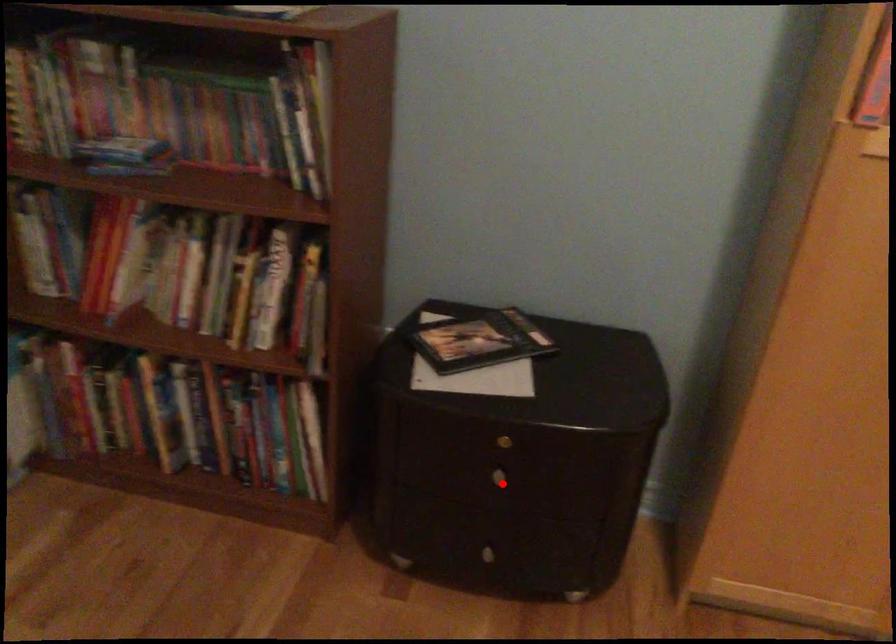
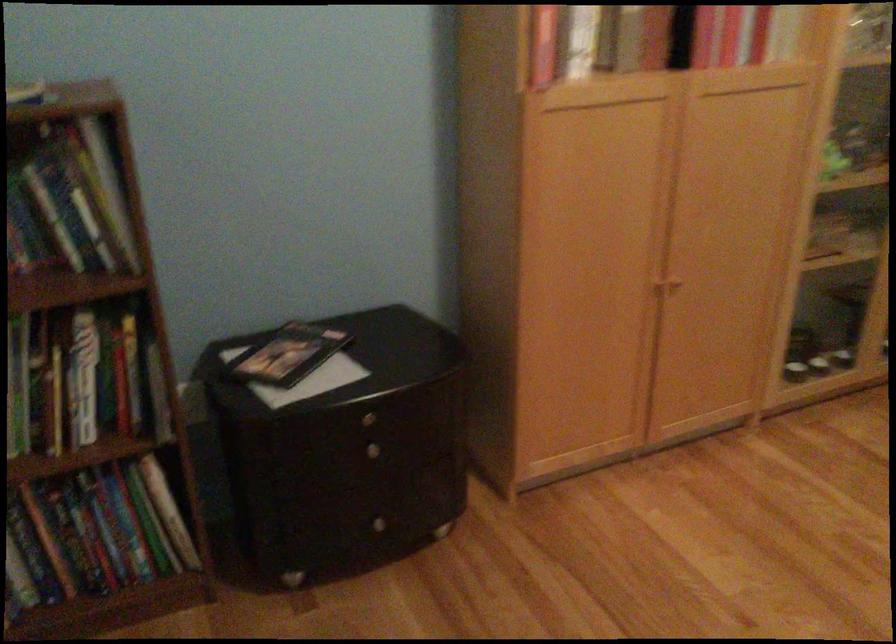
Where in the second image is the point corresponding to the highlighted location from the first image?

(376, 457)